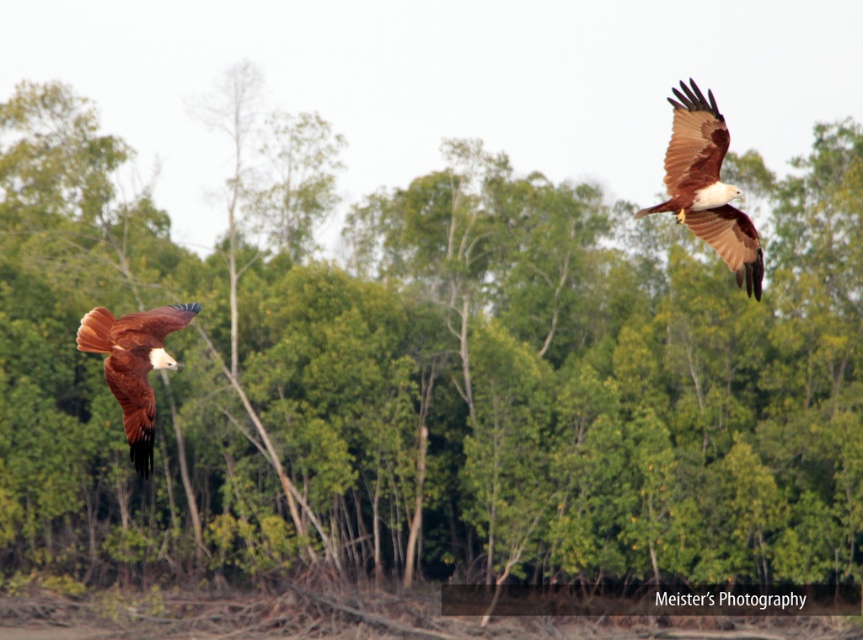
Which is in front, point (736, 214) or point (104, 340)?

Point (104, 340) is more forward.

Is brown feathered eagle at upper right closer to camera compared to rusty brown feathers at left?

That is False.

Consider the image. Measure the distance between brown feathered eagle at upper right and camera.

The distance of brown feathered eagle at upper right from camera is 106.82 meters.

This screenshot has height=640, width=863. In order to click on brown feathered eagle at upper right in this screenshot , I will do `click(707, 186)`.